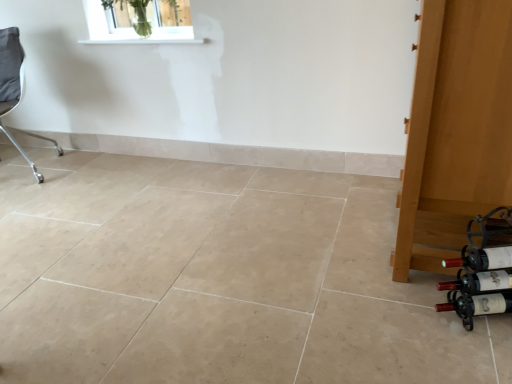
Question: Would you consider wooden door at right to be distant from clear glass vase at upper center?

Choices:
 (A) no
 (B) yes

Answer: (B)

Question: Does wooden door at right have a lesser width compared to clear glass vase at upper center?

Choices:
 (A) no
 (B) yes

Answer: (A)

Question: From a real-world perspective, is wooden door at right beneath clear glass vase at upper center?

Choices:
 (A) no
 (B) yes

Answer: (B)

Question: Is wooden door at right looking in the opposite direction of clear glass vase at upper center?

Choices:
 (A) no
 (B) yes

Answer: (A)

Question: Is wooden door at right at the left side of clear glass vase at upper center?

Choices:
 (A) yes
 (B) no

Answer: (B)

Question: Considering the relative positions of wooden door at right and matte black wine bottle at lower right, which is the first wine bottle from top to bottom, in the image provided, is wooden door at right to the left or to the right of matte black wine bottle at lower right, which is the first wine bottle from top to bottom,?

Choices:
 (A) left
 (B) right

Answer: (B)

Question: From a real-world perspective, is wooden door at right physically located above or below matte black wine bottle at lower right, which is the first wine bottle from top to bottom?

Choices:
 (A) below
 (B) above

Answer: (B)

Question: Based on their sizes in the image, would you say wooden door at right is bigger or smaller than matte black wine bottle at lower right, which is the 4th wine bottle in bottom-to-top order?

Choices:
 (A) small
 (B) big

Answer: (B)

Question: Considering the positions of wooden door at right and matte black wine bottle at lower right, which is the 4th wine bottle in bottom-to-top order, in the image, is wooden door at right taller or shorter than matte black wine bottle at lower right, which is the 4th wine bottle in bottom-to-top order,?

Choices:
 (A) short
 (B) tall

Answer: (B)

Question: Visually, is white smooth window sill at upper center positioned to the left or to the right of matte glass wine bottle at lower right, the 2th wine bottle positioned from the bottom?

Choices:
 (A) left
 (B) right

Answer: (A)

Question: Considering the positions of white smooth window sill at upper center and matte glass wine bottle at lower right, the 3th wine bottle in the top-to-bottom sequence, in the image, is white smooth window sill at upper center bigger or smaller than matte glass wine bottle at lower right, the 3th wine bottle in the top-to-bottom sequence,?

Choices:
 (A) small
 (B) big

Answer: (B)

Question: Is white smooth window sill at upper center situated inside matte glass wine bottle at lower right, the 2th wine bottle positioned from the bottom, or outside?

Choices:
 (A) outside
 (B) inside

Answer: (A)

Question: Considering the positions of white smooth window sill at upper center and matte glass wine bottle at lower right, the 3th wine bottle in the top-to-bottom sequence, in the image, is white smooth window sill at upper center taller or shorter than matte glass wine bottle at lower right, the 3th wine bottle in the top-to-bottom sequence,?

Choices:
 (A) tall
 (B) short

Answer: (B)

Question: Is matte glass wine bottle at lower right, which is the second wine bottle in top-to-bottom order, taller or shorter than white smooth window sill at upper center?

Choices:
 (A) tall
 (B) short

Answer: (A)

Question: From the image's perspective, is matte glass wine bottle at lower right, which is the second wine bottle in top-to-bottom order, above or below white smooth window sill at upper center?

Choices:
 (A) below
 (B) above

Answer: (A)